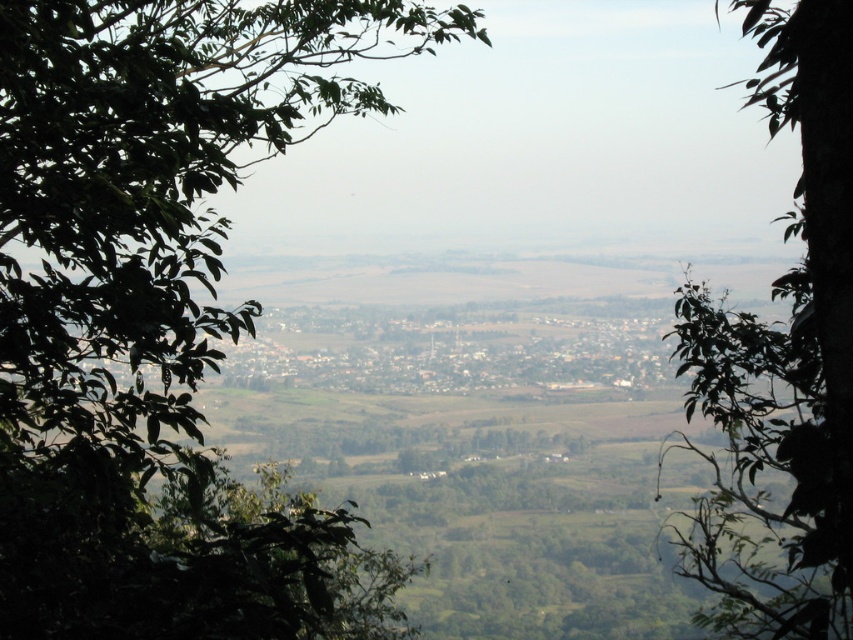
You are an ornithologist observing birds in a tropical forest. You notice two trees in the scene. The first is the green leafy tree at left, and the second is the green leafy tree at center. Which tree would likely provide more nesting space for birds based on their size?

The green leafy tree at left has a greater width than the green leafy tree at center, so it would likely provide more nesting space for birds.

You are standing at the vantage point and want to take a photo that includes both the green leafy tree at left and the green leafy tree at center. Which tree should you adjust your camera angle to focus on first to ensure both are in the frame?

You should focus on the green leafy tree at left first because it is in front of the green leafy tree at center, so adjusting the angle to include it ensures both are visible.

You are standing in a scenic area and see two green leafy trees. One is the green leafy tree at left and the other is the green leafy tree at center. From your vantage point, which tree is positioned further to the left?

The green leafy tree at left is positioned further to the left compared to the green leafy tree at center.